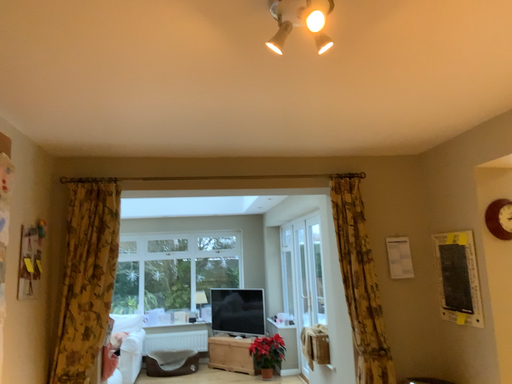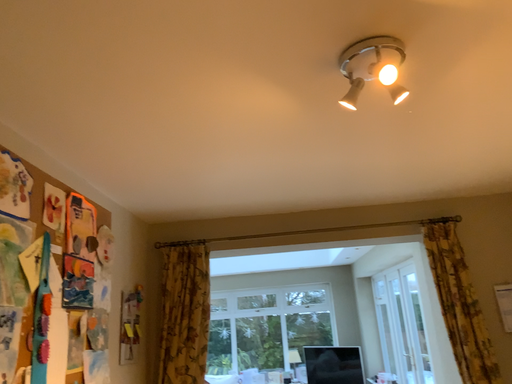
Question: Which way did the camera rotate in the video?

Choices:
 (A) rotated upward
 (B) rotated downward

Answer: (A)